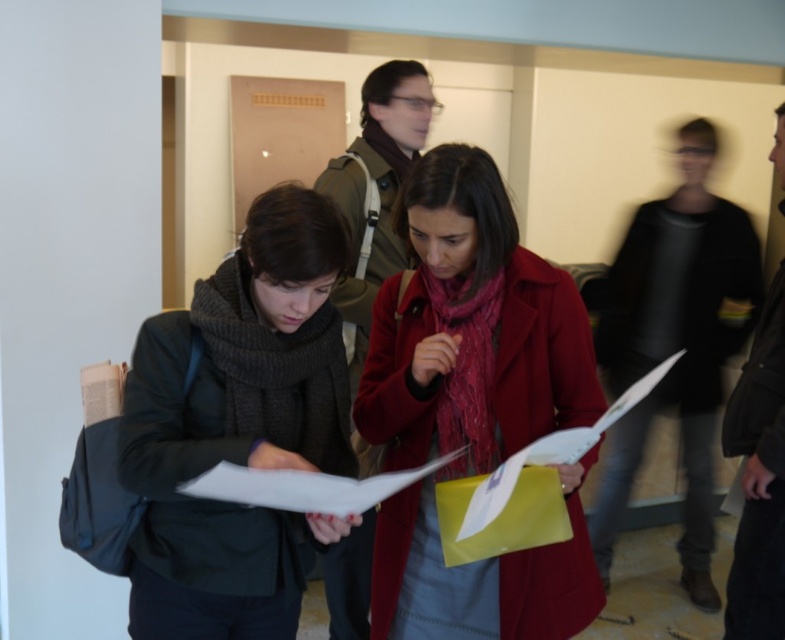
Can you confirm if knitted wool scarf at left is shorter than dark gray jacket at right?

Correct, knitted wool scarf at left is not as tall as dark gray jacket at right.

Is knitted wool scarf at left thinner than dark gray jacket at right?

No.

Locate an element on the screen. The width and height of the screenshot is (785, 640). knitted wool scarf at left is located at coordinates (238, 426).

The width and height of the screenshot is (785, 640). What are the coordinates of `knitted wool scarf at left` in the screenshot? It's located at (238, 426).

Does knitted wool scarf at left have a lesser width compared to dark gray sweater at right?

Correct, knitted wool scarf at left's width is less than dark gray sweater at right's.

Does point (287, 285) come behind point (707, 557)?

No, it is not.

Who is more distant from viewer, (134, 442) or (681, 132)?

The point (681, 132) is more distant.

Where is `knitted wool scarf at left`? The width and height of the screenshot is (785, 640). knitted wool scarf at left is located at coordinates (238, 426).

Which is more to the right, knitted wool scarf at left or matte brown jacket at center?

matte brown jacket at center

Does point (199, 410) lie behind point (356, 620)?

That is False.

Find the location of `knitted wool scarf at left`. knitted wool scarf at left is located at coordinates pyautogui.click(x=238, y=426).